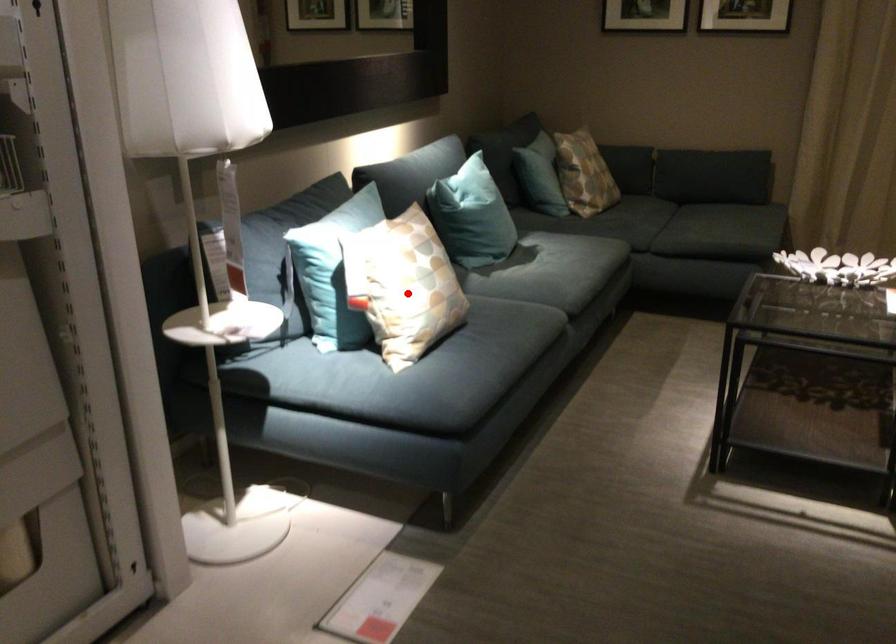
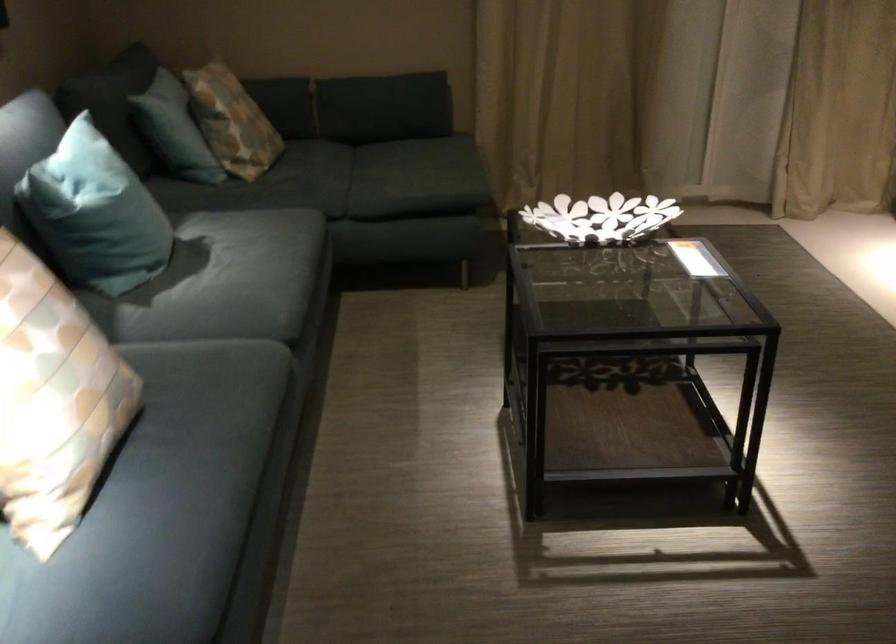
Question: I am providing you with two images of the same scene from different viewpoints. A red point is shown in image1. For the corresponding object point in image2, is it positioned nearer or farther from the camera?

Choices:
 (A) Nearer
 (B) Farther

Answer: (A)